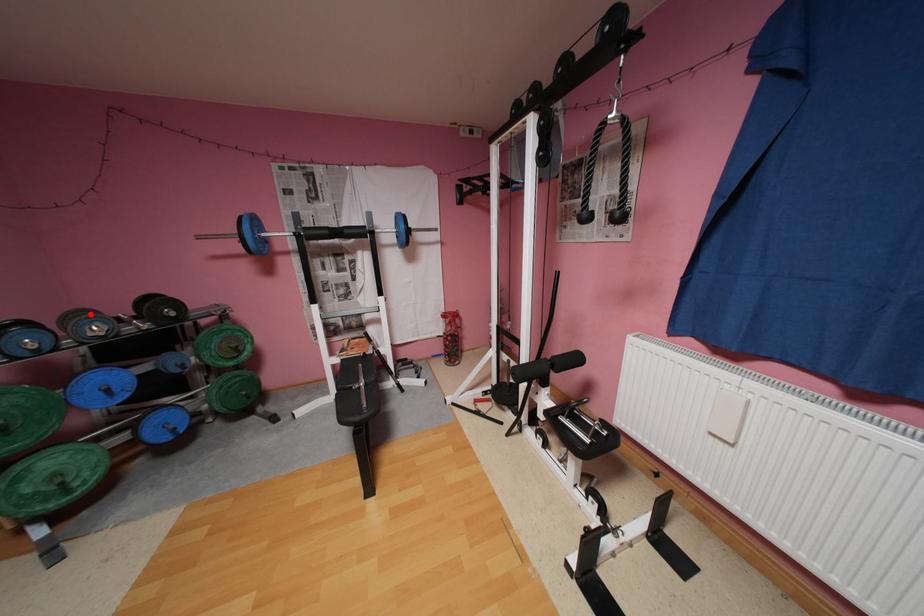
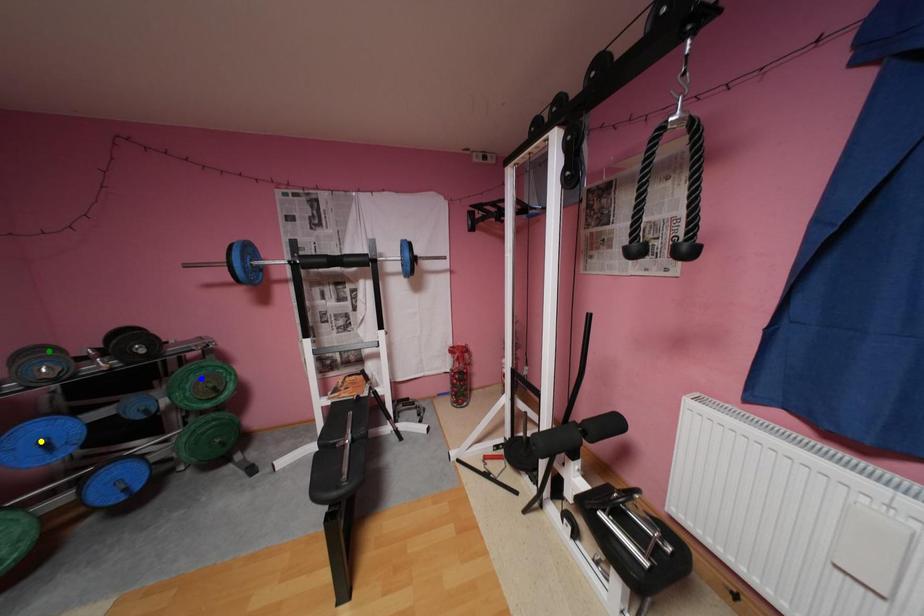
Question: I am providing you with two images of the same scene from different viewpoints. A red point is marked on the first image. You are given multiple points on the second image. Which mark in image 2 goes with the point in image 1?

Choices:
 (A) yellow point
 (B) green point
 (C) blue point

Answer: (B)